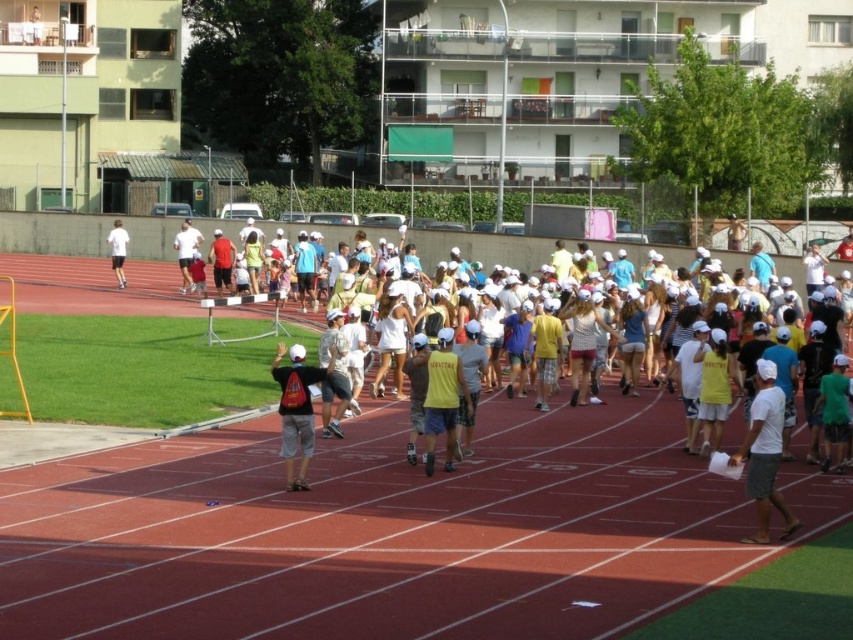
Question: Can you confirm if matte red shirt at center is thinner than white matte t-shirt at left?

Choices:
 (A) yes
 (B) no

Answer: (A)

Question: Can you confirm if matte gray shorts at center is positioned to the left of yellow matte shirt at center?

Choices:
 (A) no
 (B) yes

Answer: (B)

Question: Which object appears farthest from the camera in this image?

Choices:
 (A) yellow matte shirt at center
 (B) white matte shorts at center

Answer: (B)

Question: Observing the image, what is the correct spatial positioning of white matte shirt at lower right in reference to white matte shorts at center?

Choices:
 (A) below
 (B) above

Answer: (A)

Question: Which is farther from the white matte shorts at center?

Choices:
 (A) yellow matte shirt at center
 (B) matte red shirt at center
 (C) white matte shirt at lower right
 (D) white matte t-shirt at left

Answer: (C)

Question: Which point is closer to the camera?

Choices:
 (A) white matte t-shirt at left
 (B) yellow matte shirt at center
 (C) matte gray shorts at center
 (D) white matte shirt at lower right

Answer: (D)